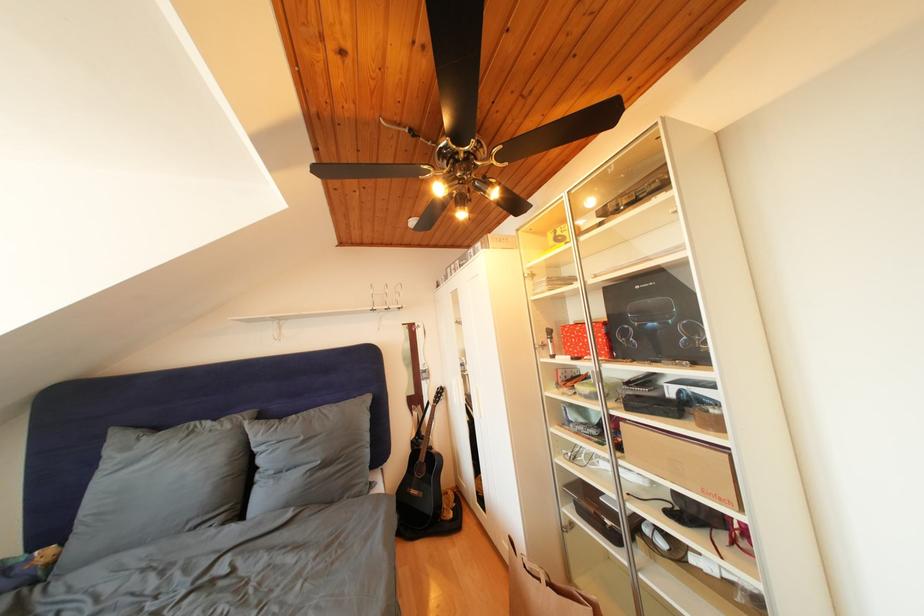
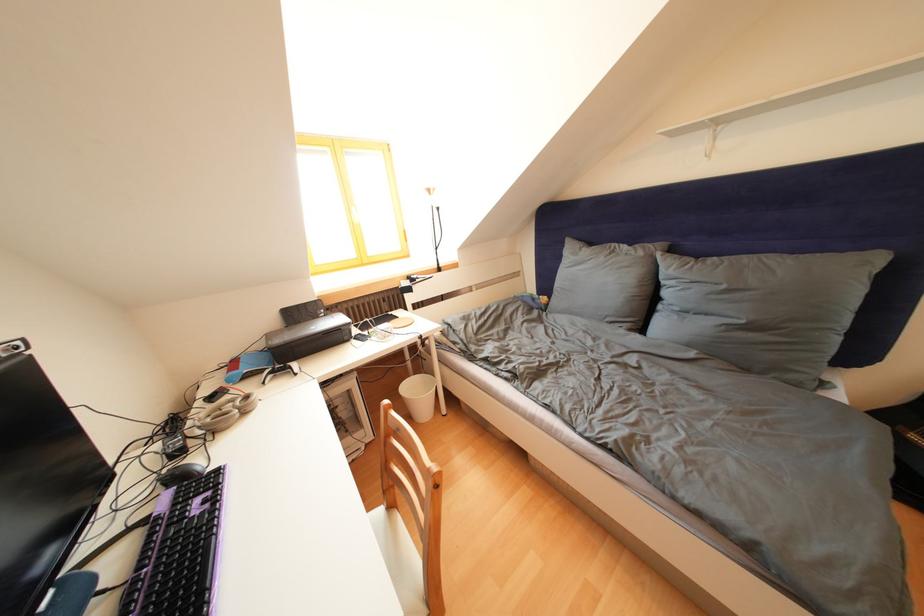
The first image is from the beginning of the video and the second image is from the end. How did the camera likely rotate when shooting the video?

The camera's rotation is toward left-down.